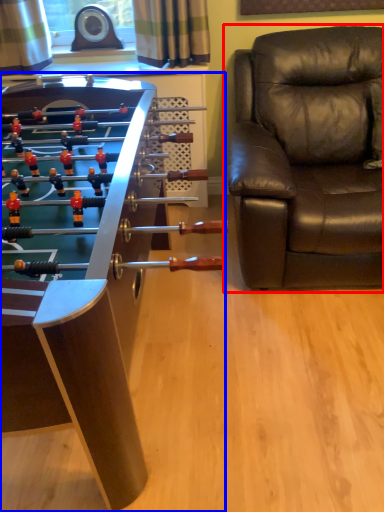
Question: Which of the following is the farthest to the observer, chair (highlighted by a red box) or table (highlighted by a blue box)?

Choices:
 (A) chair
 (B) table

Answer: (A)